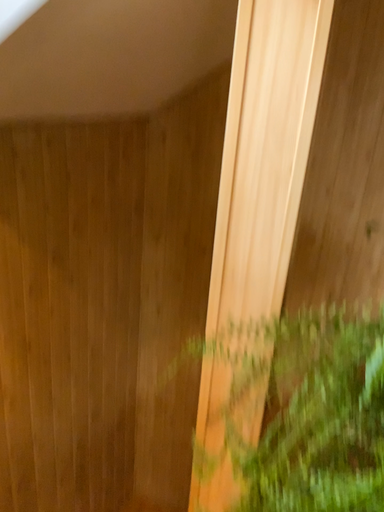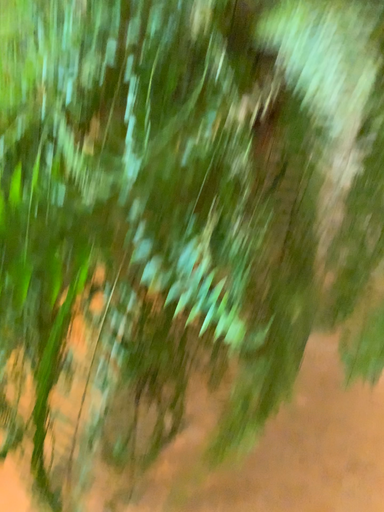
Question: Which way did the camera rotate in the video?

Choices:
 (A) rotated downward
 (B) rotated upward

Answer: (A)